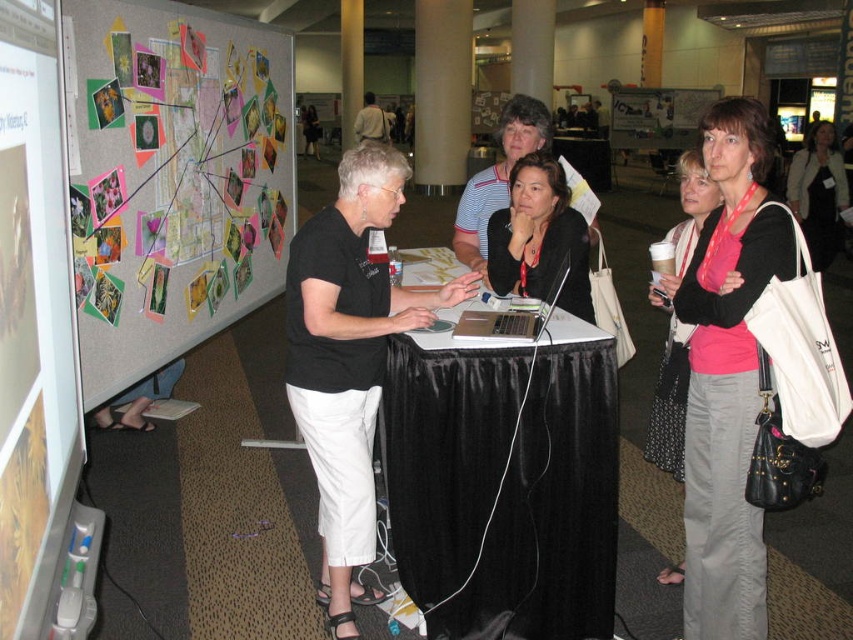
Is point (332, 470) more distant than point (524, 134)?

No, it is in front of (524, 134).

Is black matte shirt at center taller than striped cotton shirt at center?

Yes.

Image resolution: width=853 pixels, height=640 pixels. Identify the location of black matte shirt at center. (x=349, y=358).

Locate an element on the screen. black matte shirt at center is located at coordinates (349, 358).

Which is in front, point (685, 544) or point (357, 120)?

Point (685, 544) is in front.

Is point (735, 209) farther from camera compared to point (376, 124)?

No, it is in front of (376, 124).

Does point (711, 522) lie behind point (370, 138)?

No, it is in front of (370, 138).

Find the location of a particular element. This screenshot has width=853, height=640. pink fabric shirt at center is located at coordinates (727, 374).

Between multicolored paper collage at left and pink fabric shirt at center, which one is positioned higher?

multicolored paper collage at left

This screenshot has height=640, width=853. What do you see at coordinates (172, 177) in the screenshot? I see `multicolored paper collage at left` at bounding box center [172, 177].

The height and width of the screenshot is (640, 853). In order to click on multicolored paper collage at left in this screenshot , I will do `click(172, 177)`.